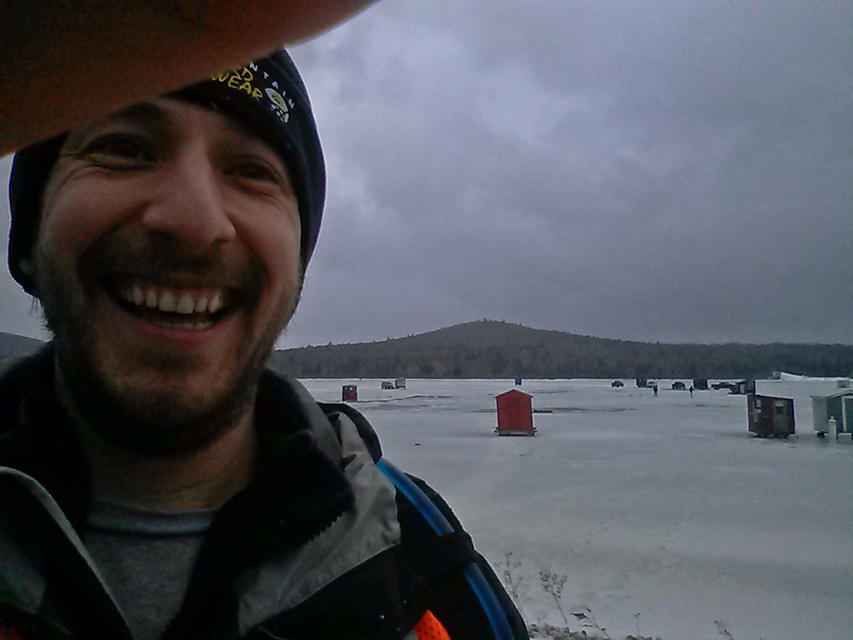
Consider the image. Can you confirm if matte black jacket at center is positioned to the right of white matte snow at center?

In fact, matte black jacket at center is to the left of white matte snow at center.

Which is below, matte black jacket at center or white matte snow at center?

white matte snow at center

The width and height of the screenshot is (853, 640). I want to click on matte black jacket at center, so click(200, 400).